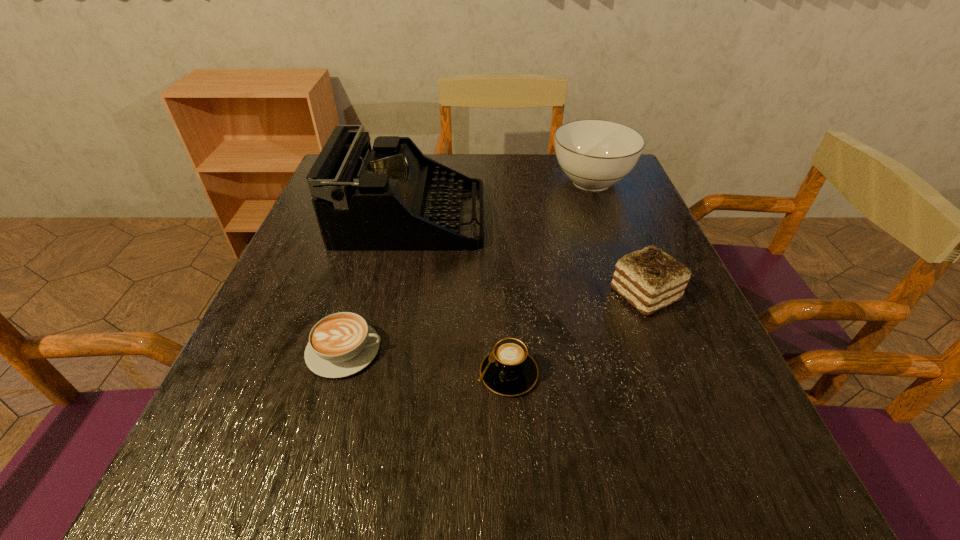
This screenshot has height=540, width=960. Find the location of `object at the far right corner`. object at the far right corner is located at coordinates (594, 154).

In the image, there is a desktop. Identify the location of vacant space at the far edge. (441, 158).

At what (x,y) coordinates should I click in order to perform the action: click on vacant space at the near edge of the desktop. Please return your answer as a coordinate pair (x, y). Looking at the image, I should click on (481, 507).

Find the location of `vacant space at the left edge of the desktop`. vacant space at the left edge of the desktop is located at coordinates (209, 440).

The width and height of the screenshot is (960, 540). In order to click on vacant space at the right edge in this screenshot , I will do `click(647, 215)`.

At what (x,y) coordinates should I click in order to perform the action: click on vacant area at the near right corner of the desktop. Please return your answer as a coordinate pair (x, y). This screenshot has height=540, width=960. Looking at the image, I should click on (736, 478).

This screenshot has width=960, height=540. Identify the location of vacant space that is in between the second tallest object and the right cappuccino. (550, 278).

Locate an element on the screen. free space between the chinaware and the third nearest object is located at coordinates (618, 238).

Identify the location of vacant region between the typewriter and the second shortest object. (460, 295).

At what (x,y) coordinates should I click in order to perform the action: click on unoccupied area between the shorter cappuccino and the third shortest object. Please return your answer as a coordinate pair (x, y). The image size is (960, 540). Looking at the image, I should click on (494, 322).